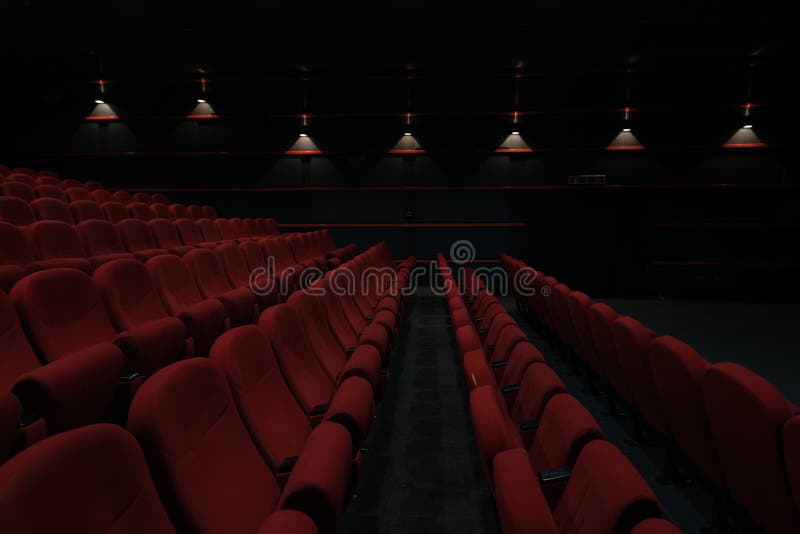
Identify the location of red bars on the wall running from left to right. (425, 262), (449, 229), (458, 191), (456, 112), (505, 76), (482, 150).